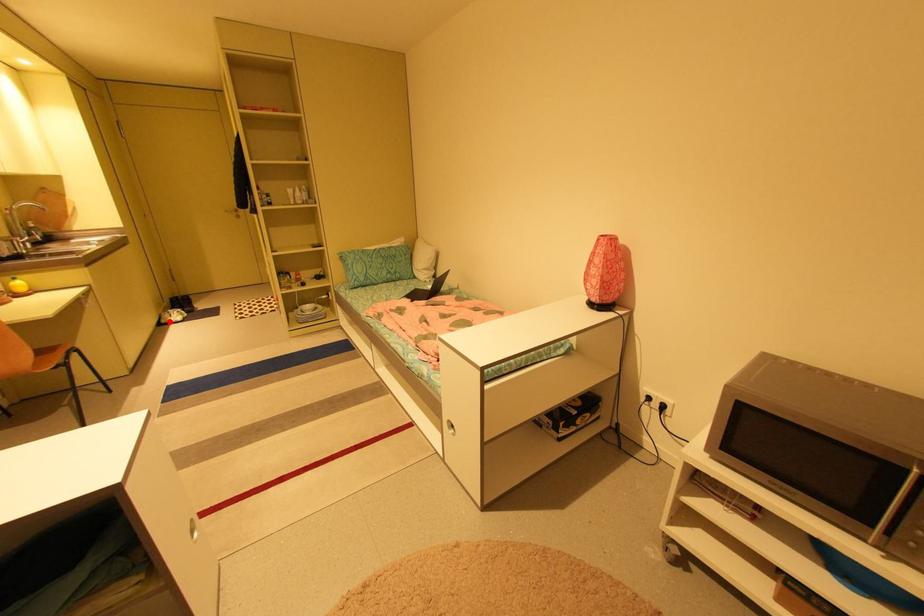
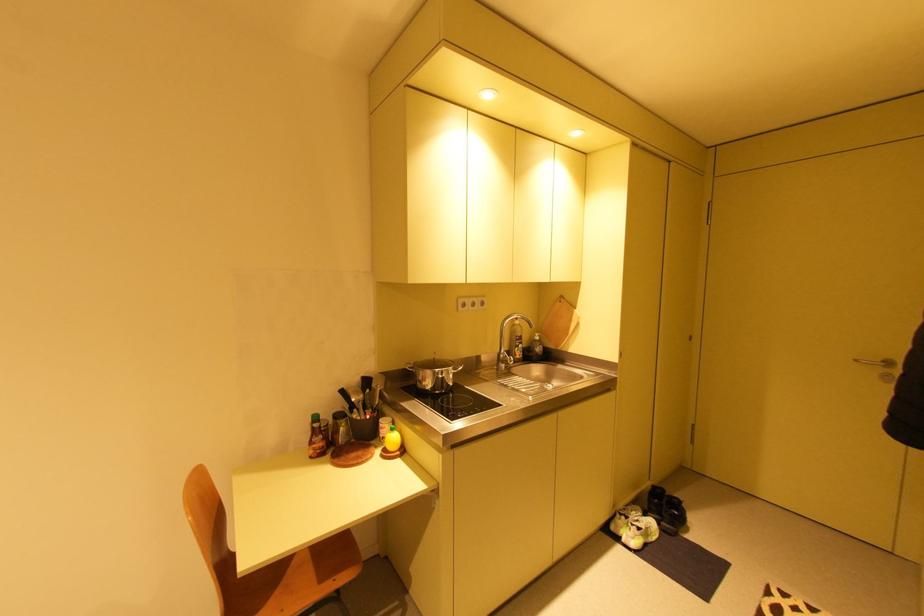
Where in the second image is the point corresponding to the highlighted location from the first image?

(617, 528)